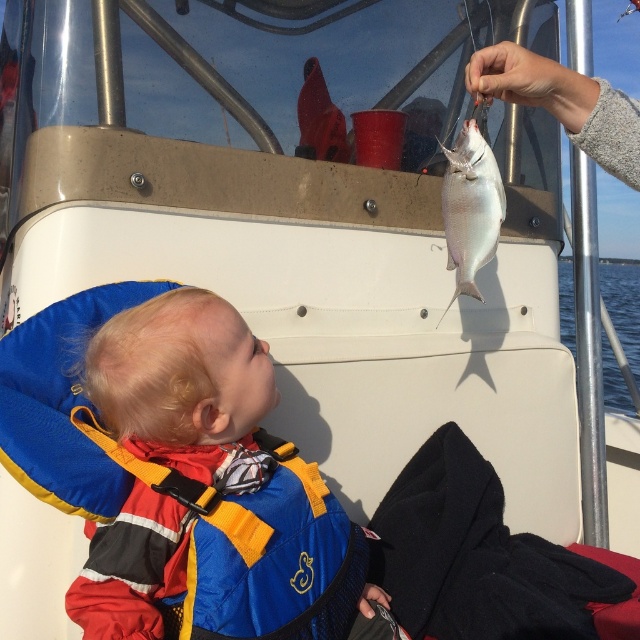
Does smooth silver fish at upper right appear on the right side of silver metallic fish at upper center?

Correct, you'll find smooth silver fish at upper right to the right of silver metallic fish at upper center.

Identify the location of smooth silver fish at upper right. (563, 104).

Is point (616, 164) closer to camera compared to point (454, 163)?

Yes, point (616, 164) is in front of point (454, 163).

I want to click on smooth silver fish at upper right, so click(x=563, y=104).

Which is above, blue fabric life vest at center or smooth silver fish at upper right?

smooth silver fish at upper right is higher up.

Between blue fabric life vest at center and smooth silver fish at upper right, which one has less height?

smooth silver fish at upper right is shorter.

Is point (176, 536) positioned in front of point (497, 76)?

Yes, point (176, 536) is in front of point (497, 76).

Find the location of a particular element. This screenshot has width=640, height=640. blue fabric life vest at center is located at coordinates (186, 388).

Which is more to the right, blue fabric life vest at center or silver metallic fish at upper center?

From the viewer's perspective, silver metallic fish at upper center appears more on the right side.

Can you confirm if blue fabric life vest at center is shorter than silver metallic fish at upper center?

In fact, blue fabric life vest at center may be taller than silver metallic fish at upper center.

This screenshot has width=640, height=640. I want to click on blue fabric life vest at center, so click(x=186, y=388).

Locate an element on the screen. This screenshot has width=640, height=640. blue fabric life vest at center is located at coordinates (186, 388).